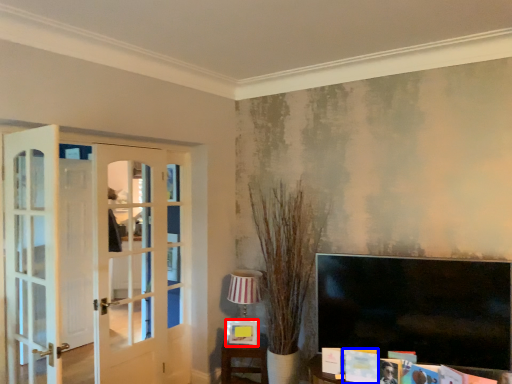
Question: Which of the following is the farthest to the observer, picture frame (highlighted by a red box) or magazine (highlighted by a blue box)?

Choices:
 (A) picture frame
 (B) magazine

Answer: (A)